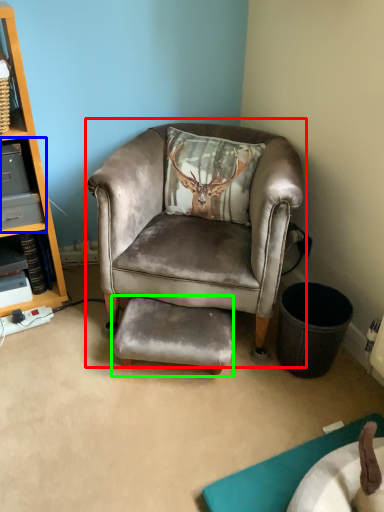
Question: Which object is the farthest from chair (highlighted by a red box)? Choose among these: shelf (highlighted by a blue box) or footrest (highlighted by a green box).

Choices:
 (A) shelf
 (B) footrest

Answer: (A)